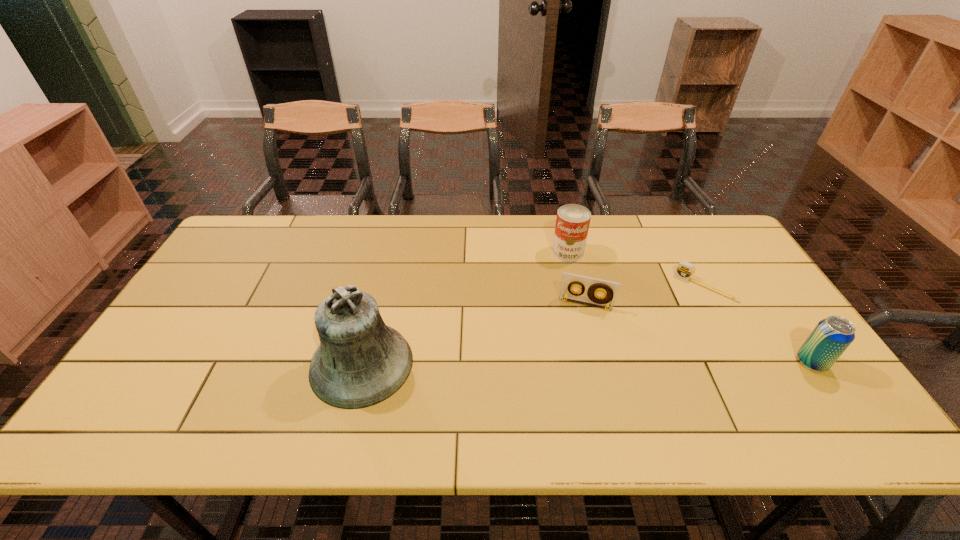
This screenshot has width=960, height=540. What are the coordinates of `free location that satisfies the following two spatial constraints: 1. on the back side of the fourth object from left to right; 2. on the right side of the leftmost object` in the screenshot? It's located at (380, 287).

You are a GUI agent. You are given a task and a screenshot of the screen. Output one action in this format:
    pyautogui.click(x=<x>, y=<y>)
    Task: Click on the free space in the image that satisfies the following two spatial constraints: 1. on the back side of the tape measure; 2. on the right side of the second shortest object
    
    Given the screenshot: What is the action you would take?
    pyautogui.click(x=581, y=287)